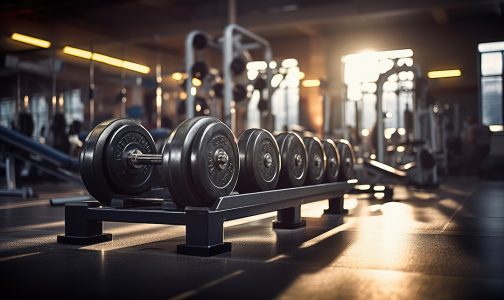
Where is `exercise bench`? This screenshot has width=504, height=300. exercise bench is located at coordinates (36, 153), (160, 137), (401, 174), (389, 153), (464, 151).